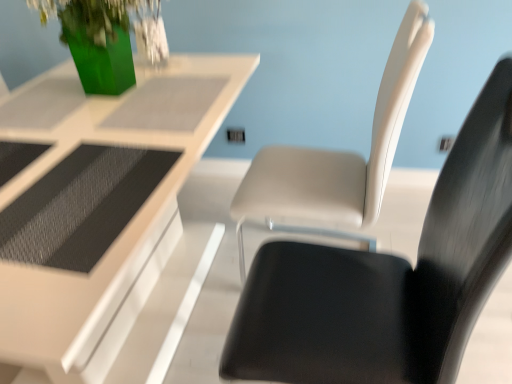
Describe the element at coordinates (338, 158) in the screenshot. I see `matte white chair at center, acting as the 2th chair starting from the front` at that location.

The width and height of the screenshot is (512, 384). What do you see at coordinates (388, 279) in the screenshot?
I see `matte white chair at center, positioned as the first chair in front-to-back order` at bounding box center [388, 279].

What do you see at coordinates (104, 217) in the screenshot?
I see `white glossy table at upper center` at bounding box center [104, 217].

The image size is (512, 384). In order to click on matte white chair at center, placed as the first chair when sorted from back to front in this screenshot , I will do `click(338, 158)`.

Is matte white chair at center, positioned as the second chair in back-to-front order, smaller than matte white chair at center, acting as the 2th chair starting from the front?

Correct, matte white chair at center, positioned as the second chair in back-to-front order, occupies less space than matte white chair at center, acting as the 2th chair starting from the front.

From the image's perspective, would you say matte white chair at center, positioned as the first chair in front-to-back order, is shown under matte white chair at center, placed as the first chair when sorted from back to front?

Yes, from the image's perspective, matte white chair at center, positioned as the first chair in front-to-back order, is below matte white chair at center, placed as the first chair when sorted from back to front.

Where is `chair located below the matte white chair at center, placed as the first chair when sorted from back to front (from the image's perspective)`? This screenshot has height=384, width=512. chair located below the matte white chair at center, placed as the first chair when sorted from back to front (from the image's perspective) is located at coordinates (388, 279).

Is matte white chair at center, positioned as the first chair in front-to-back order, next to matte white chair at center, placed as the first chair when sorted from back to front?

No, matte white chair at center, positioned as the first chair in front-to-back order, is not beside matte white chair at center, placed as the first chair when sorted from back to front.

You are a GUI agent. You are given a task and a screenshot of the screen. Output one action in this format:
    pyautogui.click(x=<x>, y=<y>)
    Task: Click on the chair on the left of matte white chair at center, positioned as the first chair in front-to-back order
    This screenshot has height=384, width=512.
    Given the screenshot: What is the action you would take?
    pyautogui.click(x=338, y=158)

Is matte white chair at center, acting as the 2th chair starting from the front, oriented away from matte white chair at center, positioned as the first chair in front-to-back order?

No, matte white chair at center, positioned as the first chair in front-to-back order, is not at the back of matte white chair at center, acting as the 2th chair starting from the front.

Is matte white chair at center, positioned as the first chair in front-to-back order, oriented away from white glossy table at upper center?

No, matte white chair at center, positioned as the first chair in front-to-back order, is not facing away from white glossy table at upper center.

From a real-world perspective, starting from the white glossy table at upper center, which chair is the 1st one vertically above it? Please provide its 2D coordinates.

[(388, 279)]

Would you say matte white chair at center, positioned as the first chair in front-to-back order, contains white glossy table at upper center?

That's incorrect, white glossy table at upper center is not inside matte white chair at center, positioned as the first chair in front-to-back order.

From the image's perspective, is matte white chair at center, positioned as the first chair in front-to-back order, located above white glossy table at upper center?

Incorrect, from the image's perspective, matte white chair at center, positioned as the first chair in front-to-back order, is lower than white glossy table at upper center.

Can you confirm if matte white chair at center, placed as the first chair when sorted from back to front, is thinner than white glossy table at upper center?

Indeed, matte white chair at center, placed as the first chair when sorted from back to front, has a lesser width compared to white glossy table at upper center.

Can you confirm if matte white chair at center, acting as the 2th chair starting from the front, is shorter than white glossy table at upper center?

No, matte white chair at center, acting as the 2th chair starting from the front, is not shorter than white glossy table at upper center.

Is matte white chair at center, placed as the first chair when sorted from back to front, not inside white glossy table at upper center?

Yes.

How many degrees apart are the facing directions of matte white chair at center, acting as the 2th chair starting from the front, and white glossy table at upper center?

The facing directions of matte white chair at center, acting as the 2th chair starting from the front, and white glossy table at upper center are 178 degrees apart.

From their relative heights in the image, would you say white glossy table at upper center is taller or shorter than matte white chair at center, positioned as the second chair in back-to-front order?

Considering their sizes, white glossy table at upper center has less height than matte white chair at center, positioned as the second chair in back-to-front order.

Which object is wider, white glossy table at upper center or matte white chair at center, positioned as the first chair in front-to-back order?

white glossy table at upper center.

Is white glossy table at upper center outside of matte white chair at center, positioned as the second chair in back-to-front order?

white glossy table at upper center is positioned outside matte white chair at center, positioned as the second chair in back-to-front order.

Is white glossy table at upper center not near matte white chair at center, positioned as the second chair in back-to-front order?

white glossy table at upper center is actually quite close to matte white chair at center, positioned as the second chair in back-to-front order.

From the image's perspective, would you say white glossy table at upper center is positioned over matte white chair at center, acting as the 2th chair starting from the front?

No, from the image's perspective, white glossy table at upper center is not over matte white chair at center, acting as the 2th chair starting from the front.

Is white glossy table at upper center far away from matte white chair at center, placed as the first chair when sorted from back to front?

white glossy table at upper center is near matte white chair at center, placed as the first chair when sorted from back to front, not far away.

Could you measure the distance between white glossy table at upper center and matte white chair at center, acting as the 2th chair starting from the front?

white glossy table at upper center is 19.34 inches from matte white chair at center, acting as the 2th chair starting from the front.

Could you tell me if white glossy table at upper center is turned towards matte white chair at center, placed as the first chair when sorted from back to front?

Yes, white glossy table at upper center faces towards matte white chair at center, placed as the first chair when sorted from back to front.

At what (x,y) coordinates should I click in order to perform the action: click on chair that is under the matte white chair at center, placed as the first chair when sorted from back to front (from a real-world perspective). Please return your answer as a coordinate pair (x, y). The width and height of the screenshot is (512, 384). Looking at the image, I should click on (388, 279).

Find the location of `chair located above the matte white chair at center, positioned as the first chair in front-to-back order (from the image's perspective)`. chair located above the matte white chair at center, positioned as the first chair in front-to-back order (from the image's perspective) is located at coordinates (338, 158).

When comparing their distances from matte white chair at center, placed as the first chair when sorted from back to front, does matte white chair at center, positioned as the second chair in back-to-front order, or white glossy table at upper center seem further?

white glossy table at upper center is positioned further to the anchor matte white chair at center, placed as the first chair when sorted from back to front.

When comparing their distances from matte white chair at center, positioned as the first chair in front-to-back order, does matte white chair at center, placed as the first chair when sorted from back to front, or white glossy table at upper center seem further?

white glossy table at upper center is further to matte white chair at center, positioned as the first chair in front-to-back order.

Which object lies nearer to the anchor point matte white chair at center, positioned as the first chair in front-to-back order, white glossy table at upper center or matte white chair at center, acting as the 2th chair starting from the front?

matte white chair at center, acting as the 2th chair starting from the front, is positioned closer to the anchor matte white chair at center, positioned as the first chair in front-to-back order.

When comparing their distances from matte white chair at center, acting as the 2th chair starting from the front, does white glossy table at upper center or matte white chair at center, positioned as the first chair in front-to-back order, seem further?

Among the two, white glossy table at upper center is located further to matte white chair at center, acting as the 2th chair starting from the front.

When comparing their distances from white glossy table at upper center, does matte white chair at center, positioned as the second chair in back-to-front order, or matte white chair at center, acting as the 2th chair starting from the front, seem closer?

matte white chair at center, acting as the 2th chair starting from the front, is closer to white glossy table at upper center.

Considering their positions, is matte white chair at center, acting as the 2th chair starting from the front, positioned closer to white glossy table at upper center than matte white chair at center, positioned as the first chair in front-to-back order?

Among the two, matte white chair at center, acting as the 2th chair starting from the front, is located nearer to white glossy table at upper center.

Where is `chair situated between white glossy table at upper center and matte white chair at center, positioned as the second chair in back-to-front order, from left to right`? chair situated between white glossy table at upper center and matte white chair at center, positioned as the second chair in back-to-front order, from left to right is located at coordinates tap(338, 158).